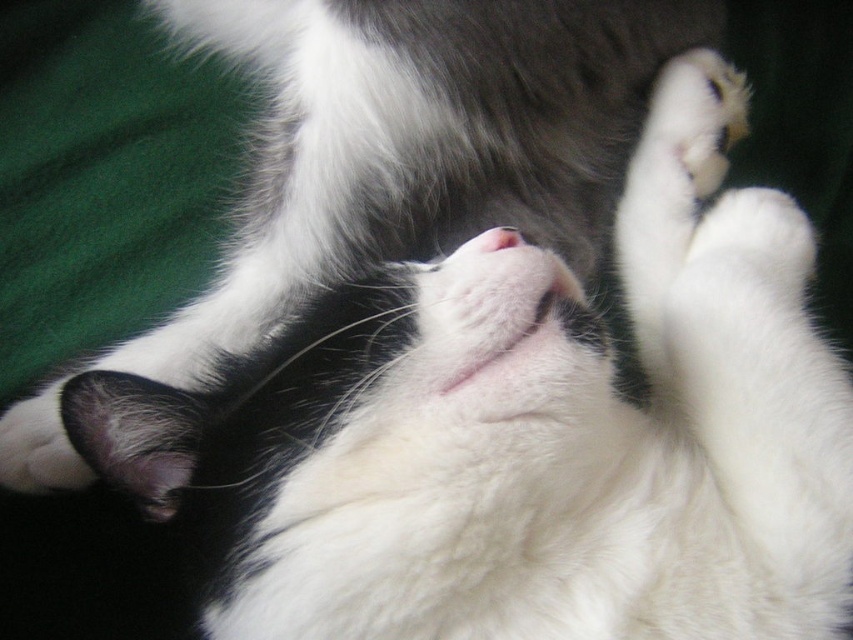
In the scene shown: Between white fluffy cat at center and pink fur at center, which one is positioned lower?

pink fur at center is lower down.

Can you confirm if white fluffy cat at center is shorter than pink fur at center?

Incorrect, white fluffy cat at center's height does not fall short of pink fur at center's.

Which is in front, point (299, 113) or point (498, 240)?

Point (498, 240) is in front.

Locate an element on the screen. white fluffy cat at center is located at coordinates (415, 141).